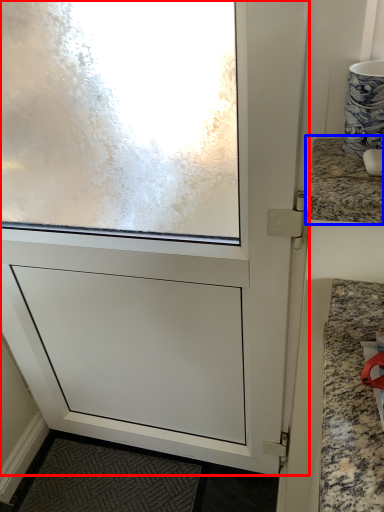
Question: Among these objects, which one is farthest to the camera, screen door (highlighted by a red box) or countertop (highlighted by a blue box)?

Choices:
 (A) screen door
 (B) countertop

Answer: (A)